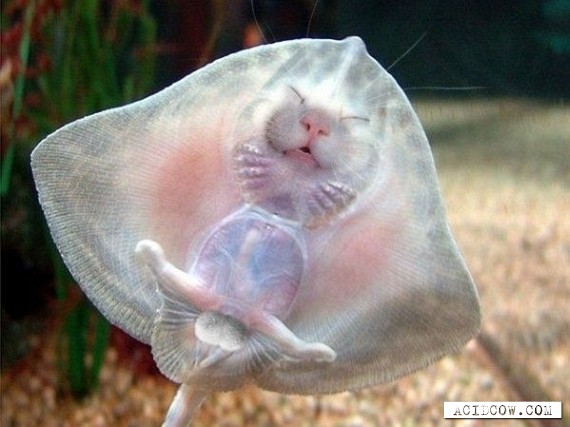
Where is `purple chest`? purple chest is located at coordinates (274, 270).